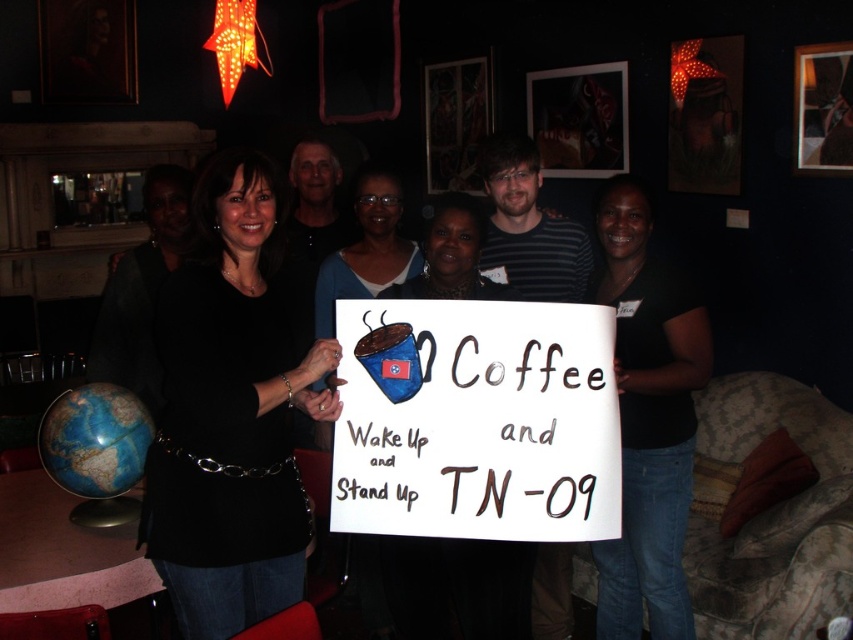
The width and height of the screenshot is (853, 640). Describe the element at coordinates (648, 419) in the screenshot. I see `black fabric shirt at center` at that location.

Can you confirm if black fabric shirt at center is taller than blue fabric mug at center?

Indeed, black fabric shirt at center has a greater height compared to blue fabric mug at center.

Between point (614, 216) and point (389, 264), which one is positioned in front?

Point (614, 216) is in front.

What are the coordinates of `black fabric shirt at center` in the screenshot? It's located at (648, 419).

Who is more distant from viewer, (216, 396) or (708, 360)?

Point (708, 360)

Does point (222, 205) lie in front of point (641, 280)?

Yes, it is in front of point (641, 280).

Locate an element on the screen. black matte shirt at center is located at coordinates (230, 412).

Is black matte shirt at center closer to camera compared to blue fabric mug at center?

That is True.

Which is in front, point (231, 280) or point (401, 268)?

Positioned in front is point (231, 280).

The height and width of the screenshot is (640, 853). Find the location of `black matte shirt at center`. black matte shirt at center is located at coordinates (230, 412).

In order to click on black matte shirt at center in this screenshot , I will do pos(230,412).